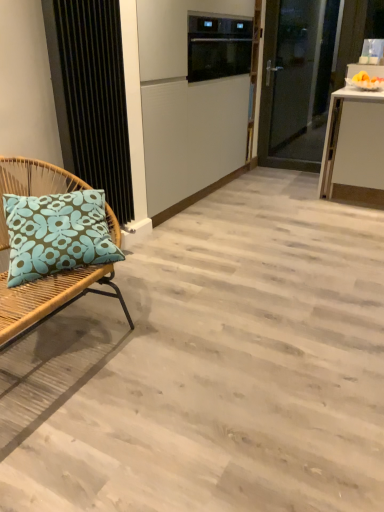
Where is `rattan cushion at left`? The width and height of the screenshot is (384, 512). rattan cushion at left is located at coordinates (49, 298).

In the image, there is a black glass oven at upper center. In order to click on chair below it (from the image's perspective) in this screenshot , I will do `click(49, 298)`.

How much distance is there between black glass oven at upper center and rattan cushion at left?

black glass oven at upper center and rattan cushion at left are 6.88 feet apart.

Which is in front, black glass oven at upper center or rattan cushion at left?

rattan cushion at left is in front.

Which is more to the right, black glass oven at upper center or rattan cushion at left?

Positioned to the right is black glass oven at upper center.

Considering the sizes of objects black glass oven at upper center and transparent glass door at upper right in the image provided, who is taller, black glass oven at upper center or transparent glass door at upper right?

Standing taller between the two is transparent glass door at upper right.

This screenshot has height=512, width=384. I want to click on door beneath the black glass oven at upper center (from a real-world perspective), so click(x=296, y=82).

Does point (210, 26) come farther from viewer compared to point (303, 95)?

No, (210, 26) is in front of (303, 95).

Considering the sizes of black glass oven at upper center and transparent glass door at upper right in the image, is black glass oven at upper center wider or thinner than transparent glass door at upper right?

black glass oven at upper center is wider than transparent glass door at upper right.

Does black textured radiator at left appear on the right side of rattan cushion at left?

Indeed, black textured radiator at left is positioned on the right side of rattan cushion at left.

In terms of height, does black textured radiator at left look taller or shorter compared to rattan cushion at left?

Clearly, black textured radiator at left is taller compared to rattan cushion at left.

From the image's perspective, does black textured radiator at left appear lower than rattan cushion at left?

Incorrect, from the image's perspective, black textured radiator at left is higher than rattan cushion at left.

Considering the relative positions of black textured radiator at left and black glass oven at upper center in the image provided, is black textured radiator at left to the left or to the right of black glass oven at upper center?

In the image, black textured radiator at left appears on the left side of black glass oven at upper center.

Choose the correct answer: Is black textured radiator at left inside black glass oven at upper center or outside it?

black textured radiator at left lies outside black glass oven at upper center.

Does black textured radiator at left have a lesser width compared to black glass oven at upper center?

Yes, black textured radiator at left is thinner than black glass oven at upper center.

Could you tell me if black textured radiator at left is facing black glass oven at upper center?

No, black textured radiator at left is not oriented towards black glass oven at upper center.

Is transparent glass door at upper right next to black glass oven at upper center?

No.

Is transparent glass door at upper right spatially inside black glass oven at upper center, or outside of it?

transparent glass door at upper right exists outside the volume of black glass oven at upper center.

Can you confirm if transparent glass door at upper right is bigger than black glass oven at upper center?

Yes, transparent glass door at upper right is bigger than black glass oven at upper center.

Is transparent glass door at upper right at the back of black textured radiator at left?

No, black textured radiator at left's orientation is not away from transparent glass door at upper right.

Which object is further away from the camera, black textured radiator at left or transparent glass door at upper right?

transparent glass door at upper right is more distant.

In terms of height, does black textured radiator at left look taller or shorter compared to transparent glass door at upper right?

Considering their sizes, black textured radiator at left has less height than transparent glass door at upper right.

Can you tell me how much black textured radiator at left and transparent glass door at upper right differ in facing direction?

89.8 degrees separate the facing orientations of black textured radiator at left and transparent glass door at upper right.

Which point is more distant from viewer, (108, 218) or (214, 51)?

The point (214, 51) is behind.

Which of these two, rattan cushion at left or black glass oven at upper center, stands taller?

With more height is black glass oven at upper center.

From a real-world perspective, which is physically below, rattan cushion at left or black glass oven at upper center?

In real-world perspective, rattan cushion at left is lower.

Where is `chair that appears below the black glass oven at upper center (from a real-world perspective)`? This screenshot has width=384, height=512. chair that appears below the black glass oven at upper center (from a real-world perspective) is located at coordinates (49, 298).

Identify the location of appliance that is above the transparent glass door at upper right (from a real-world perspective). (218, 47).

Looking at the image, which one is located closer to rattan cushion at left, black glass oven at upper center or black textured radiator at left?

Based on the image, black textured radiator at left appears to be nearer to rattan cushion at left.

Which object lies nearer to the anchor point black glass oven at upper center, black textured radiator at left or transparent glass door at upper right?

transparent glass door at upper right lies closer to black glass oven at upper center than the other object.

Which object lies nearer to the anchor point transparent glass door at upper right, rattan cushion at left or black textured radiator at left?

black textured radiator at left is closer to transparent glass door at upper right.

Which object lies nearer to the anchor point black glass oven at upper center, rattan cushion at left or transparent glass door at upper right?

The object closer to black glass oven at upper center is transparent glass door at upper right.

Based on their spatial positions, is rattan cushion at left or black textured radiator at left further from black glass oven at upper center?

rattan cushion at left.

Considering their positions, is rattan cushion at left positioned closer to transparent glass door at upper right than black glass oven at upper center?

Among the two, black glass oven at upper center is located nearer to transparent glass door at upper right.

Based on their spatial positions, is rattan cushion at left or black glass oven at upper center further from black textured radiator at left?

black glass oven at upper center is positioned further to the anchor black textured radiator at left.

Considering their positions, is black glass oven at upper center positioned closer to transparent glass door at upper right than rattan cushion at left?

black glass oven at upper center.

The width and height of the screenshot is (384, 512). Identify the location of appliance between black textured radiator at left and transparent glass door at upper right from front to back. (218, 47).

Locate an element on the screen. The width and height of the screenshot is (384, 512). radiator between rattan cushion at left and black glass oven at upper center from front to back is located at coordinates click(x=91, y=95).

Locate an element on the screen. appliance located between rattan cushion at left and transparent glass door at upper right in the depth direction is located at coordinates (218, 47).

Find the location of a particular element. Image resolution: width=384 pixels, height=512 pixels. radiator between rattan cushion at left and transparent glass door at upper right along the z-axis is located at coordinates (91, 95).